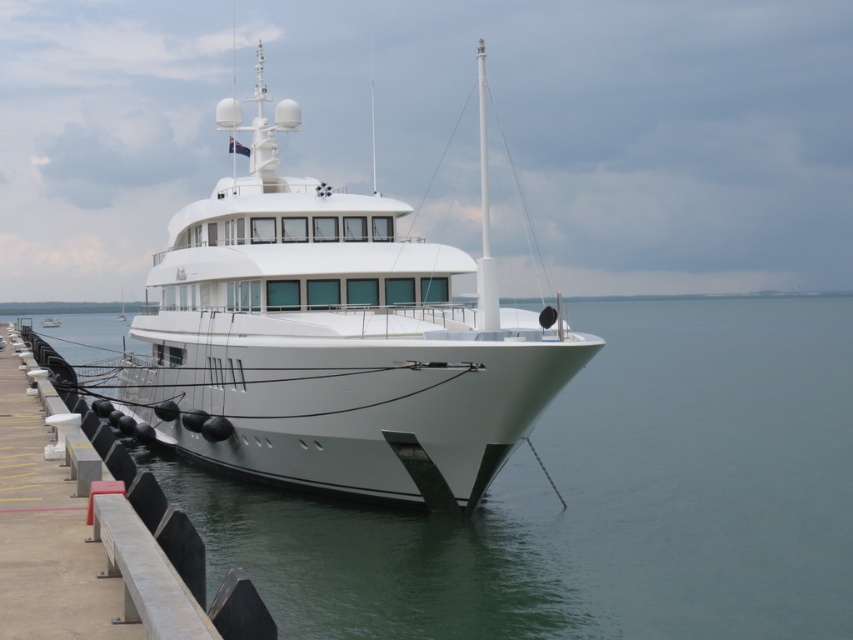
Can you confirm if clear water at lower left is smaller than white glossy yacht at center?

Yes.

Is clear water at lower left above white glossy yacht at center?

Actually, clear water at lower left is below white glossy yacht at center.

Is point (347, 515) positioned in front of point (172, 429)?

Yes, point (347, 515) is in front of point (172, 429).

The height and width of the screenshot is (640, 853). Identify the location of clear water at lower left. (596, 499).